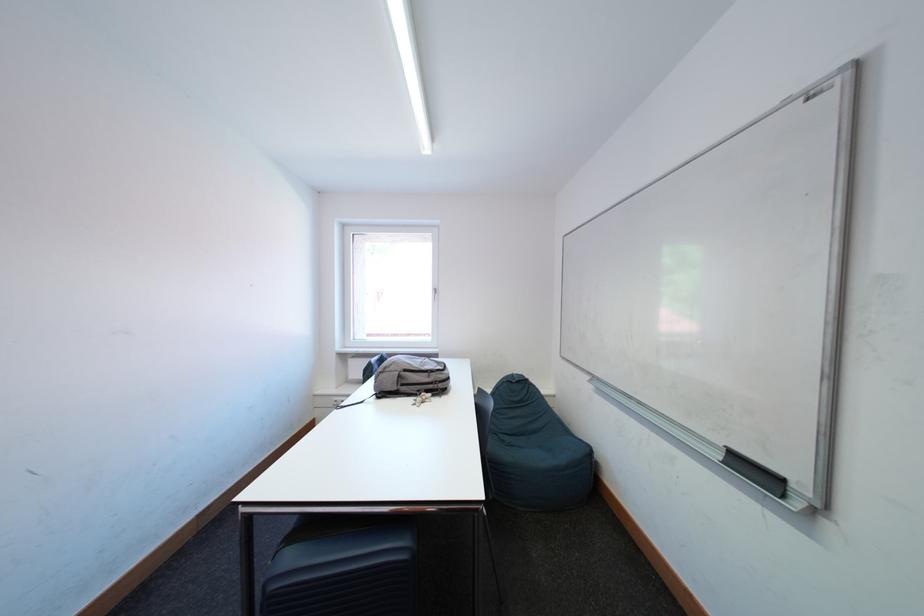
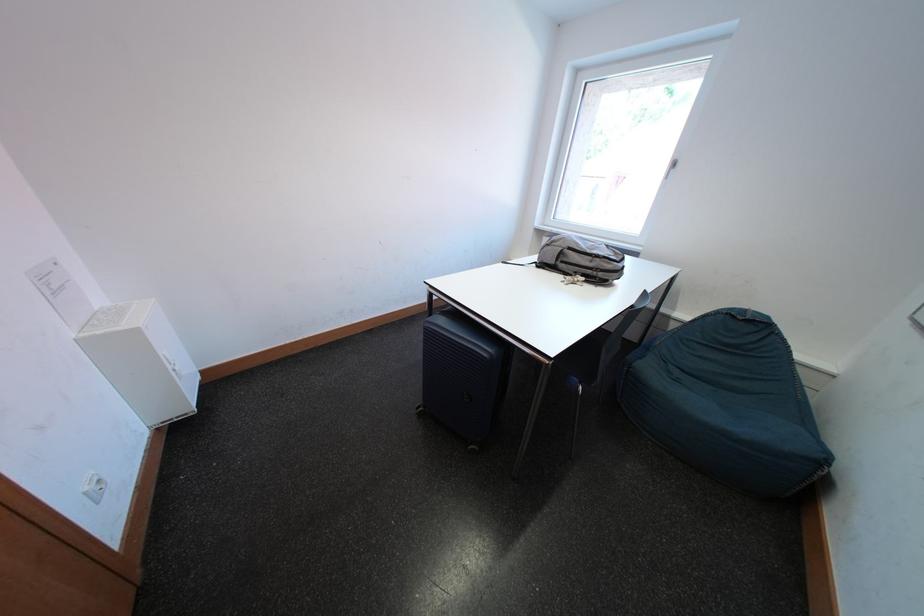
In the second image, find the point that corresponds to the point at 516,440 in the first image.

(687, 376)